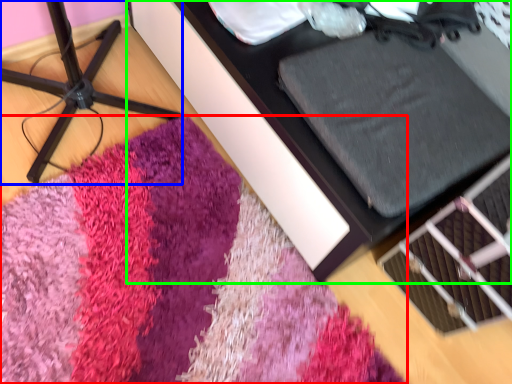
Question: Considering the real-world distances, which object is farthest from mat (highlighted by a red box)? furniture (highlighted by a blue box) or furniture (highlighted by a green box)?

Choices:
 (A) furniture
 (B) furniture

Answer: (A)